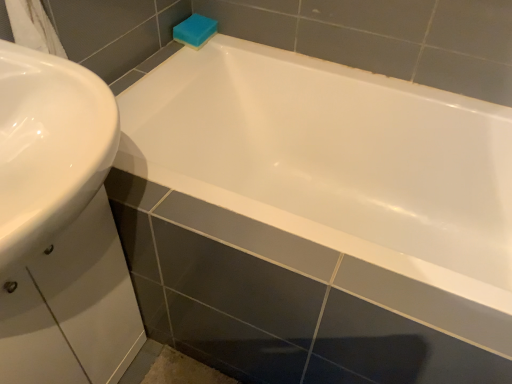
I want to click on blue sponge at upper center, so click(x=195, y=31).

This screenshot has height=384, width=512. What do you see at coordinates (195, 31) in the screenshot?
I see `blue sponge at upper center` at bounding box center [195, 31].

This screenshot has width=512, height=384. What are the coordinates of `blue sponge at upper center` in the screenshot? It's located at (195, 31).